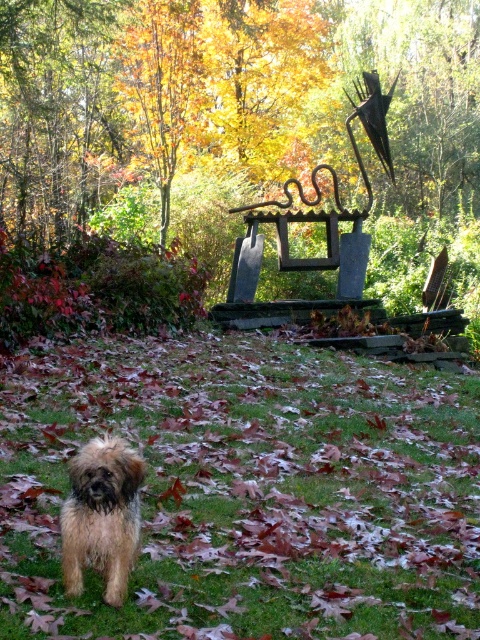
You are a photographer standing in the garden and want to take a photo of the green grass at center and the fuzzy brown dog at lower left. Which object is closer to you?

The green grass at center is closer to you than the fuzzy brown dog at lower left because it is further to the viewer.

You are a gardener who wants to plant a new flower bed in the garden. You need to choose between the green grass at center and the area where the fuzzy brown dog at lower left is standing. Which location would be more suitable for planting flowers?

The green grass at center has a lesser height compared to the fuzzy brown dog at lower left, so it would be more suitable for planting flowers since shorter grass is easier to cultivate and maintain.

You are a drone operator trying to capture a photo of the green grass at center. The camera is currently pointing at coordinates where the dog is standing. To adjust the camera to the correct position, should you move the camera upwards or downwards?

The green grass at center is located at coordinates point [249,490]. Since the dog is in the foreground, which is lower in the image, moving the camera upwards would bring the green grass at center into focus as it is positioned higher on the y axis.